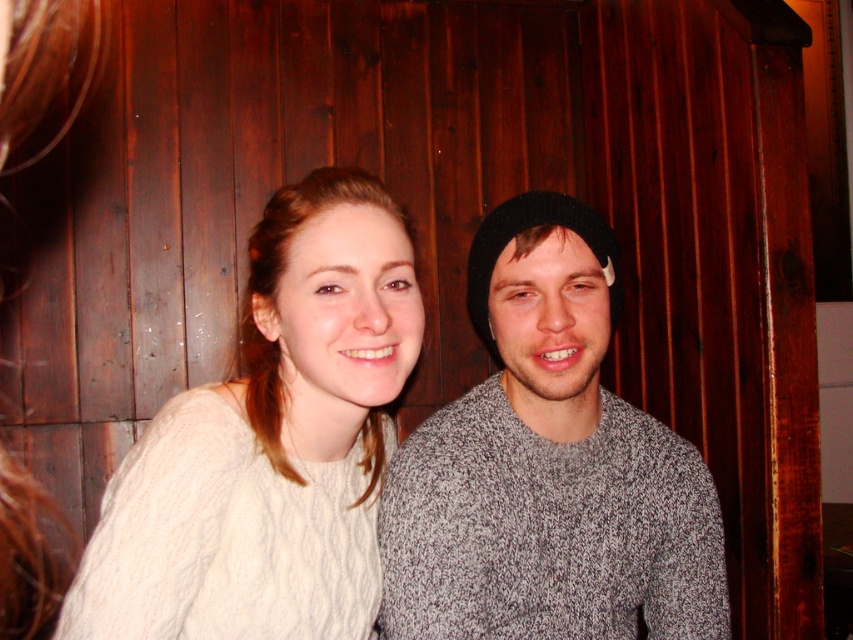
Which of these two, white cable-knit sweater at center or knitted gray sweater at center, stands shorter?

Standing shorter between the two is white cable-knit sweater at center.

Who is taller, white cable-knit sweater at center or knitted gray sweater at center?

Standing taller between the two is knitted gray sweater at center.

Is point (299, 416) positioned in front of point (408, 563)?

Yes, it is.

Identify the location of white cable-knit sweater at center. Image resolution: width=853 pixels, height=640 pixels. (270, 444).

From the picture: Is white cable-knit sweater at center positioned behind black knit beanie at center?

That is False.

Is point (177, 428) positioned behind point (480, 280)?

No, it is not.

Where is `white cable-knit sweater at center`? white cable-knit sweater at center is located at coordinates (270, 444).

Locate an element on the screen. The image size is (853, 640). white cable-knit sweater at center is located at coordinates (270, 444).

Who is positioned more to the right, knitted gray sweater at center or black knit beanie at center?

black knit beanie at center is more to the right.

Can you confirm if knitted gray sweater at center is taller than black knit beanie at center?

Indeed, knitted gray sweater at center has a greater height compared to black knit beanie at center.

At what (x,y) coordinates should I click in order to perform the action: click on knitted gray sweater at center. Please return your answer as a coordinate pair (x, y). Looking at the image, I should click on (548, 465).